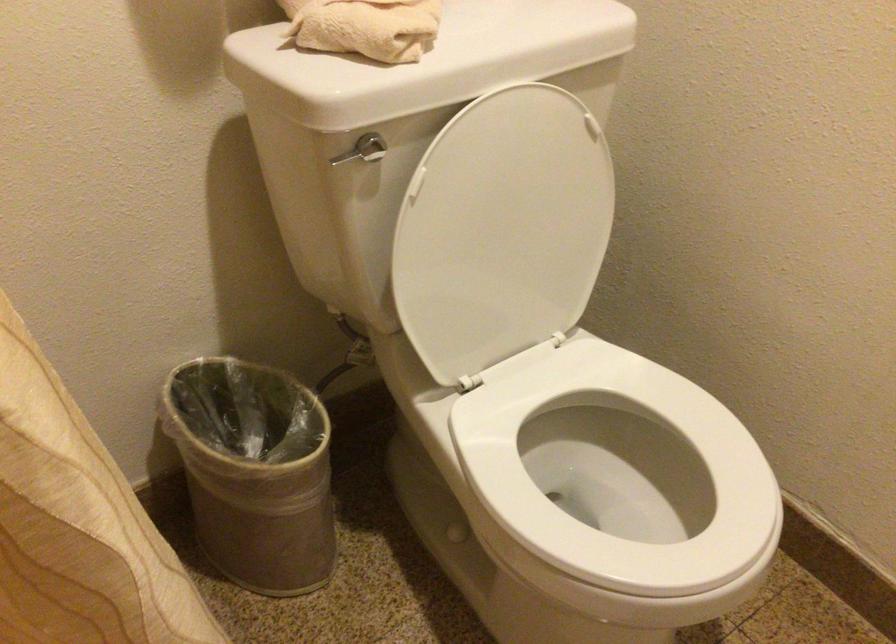
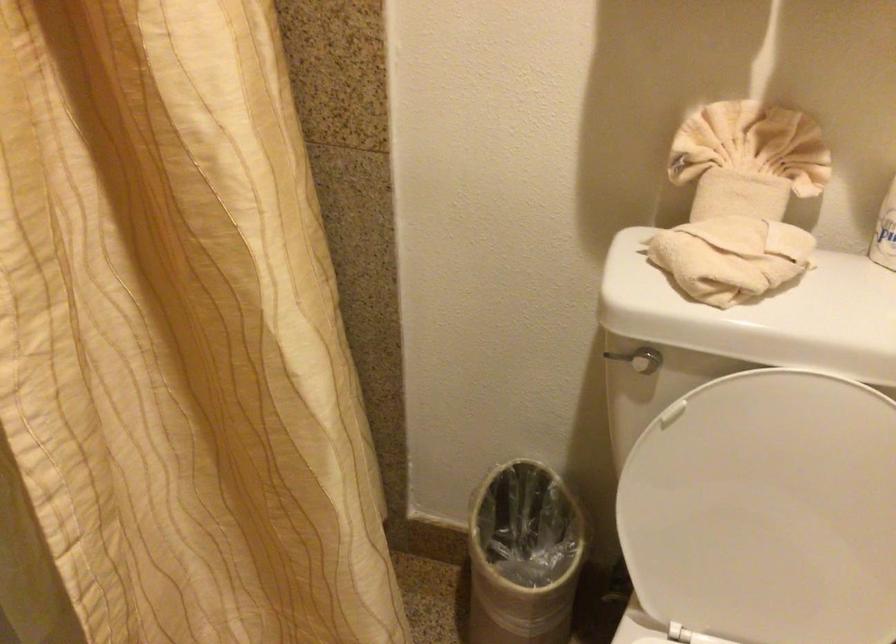
Locate, in the second image, the point that corresponds to [501,234] in the first image.

(767, 511)